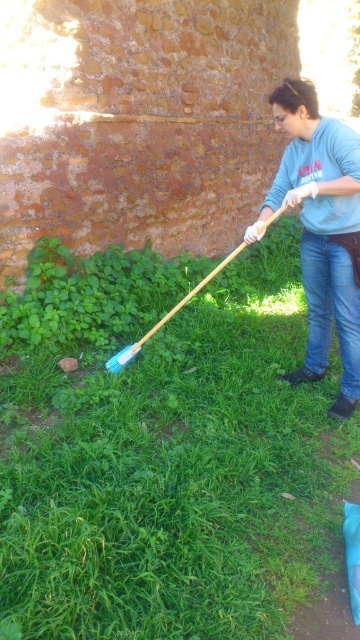
Is green grass at lower left thinner than blue plastic shovel at center?

Incorrect, green grass at lower left's width is not less than blue plastic shovel at center's.

Which is more to the right, green grass at lower left or blue plastic shovel at center?

blue plastic shovel at center is more to the right.

Which is in front, point (281, 570) or point (176, 308)?

Positioned in front is point (281, 570).

The height and width of the screenshot is (640, 360). In order to click on green grass at lower left in this screenshot , I will do [x=173, y=474].

This screenshot has width=360, height=640. Describe the element at coordinates (173, 474) in the screenshot. I see `green grass at lower left` at that location.

Does green grass at lower left have a lesser height compared to blue cotton sweater at center?

Yes.

Find the location of `green grass at lower left`. green grass at lower left is located at coordinates (173, 474).

The image size is (360, 640). What do you see at coordinates (321, 228) in the screenshot?
I see `blue cotton sweater at center` at bounding box center [321, 228].

Can you confirm if blue cotton sweater at center is positioned above blue plastic shovel at center?

Incorrect, blue cotton sweater at center is not positioned above blue plastic shovel at center.

Measure the distance between blue cotton sweater at center and camera.

A distance of 2.21 meters exists between blue cotton sweater at center and camera.

Identify the location of blue cotton sweater at center. (321, 228).